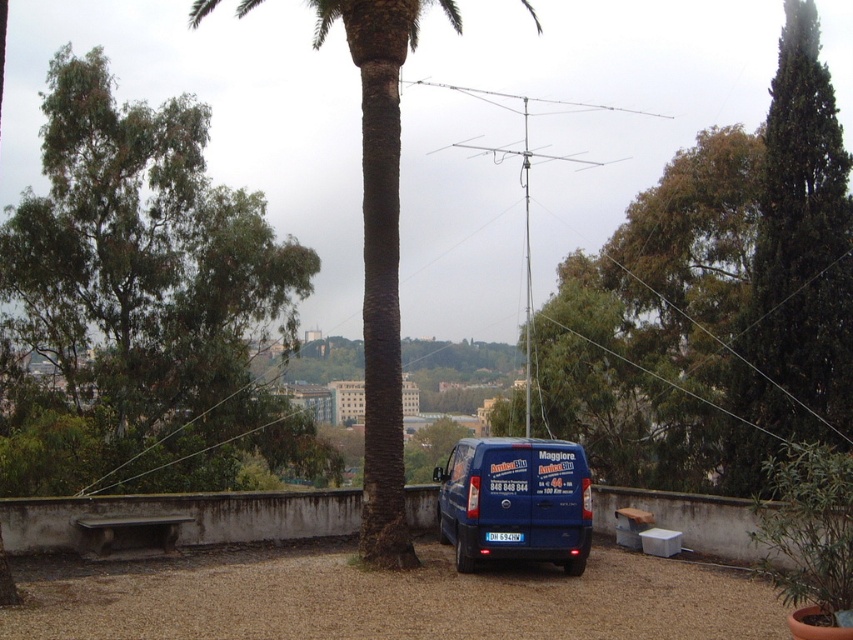
You are standing on the rooftop and want to take a photo of the distant buildings. The green textured palm tree at center might block your view. Can you determine if the blue matte van at center is shorter than the palm tree, allowing you to position yourself behind the van to avoid the tree blocking the shot?

The green textured palm tree at center is taller than the blue matte van at center. Therefore, positioning yourself behind the van would still leave the palm tree blocking the view of the distant buildings.

You are a delivery person who needs to park your vehicle between the green leafy tree at left and the blue matte van at center. The parking space between them must be exactly 10 meters. Is there enough space to park your vehicle there?

The distance between the green leafy tree at left and the blue matte van at center is 10.93 meters, which is more than the required 10 meters. Therefore, there is enough space to park your vehicle between them.

You are standing at the base of the palm tree trunk in the center of the image. You want to walk to the green leafy tree at left. How far will you have to walk?

The green leafy tree at left and the viewer are 16.81 meters apart, so you will have to walk 16.81 meters to reach it.